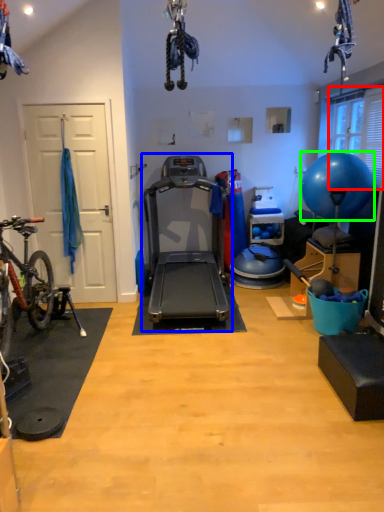
Question: Which object is the farthest from window screen (highlighted by a red box)? Choose among these: treadmill (highlighted by a blue box) or ball (highlighted by a green box).

Choices:
 (A) treadmill
 (B) ball

Answer: (A)